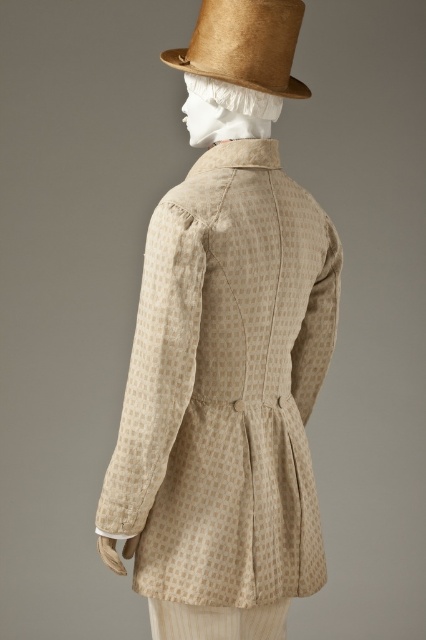
You are a tailor measuring garments for a costume. You need to determine which item is taller between the beige textured jacket at center and the brown straw hat at upper center. Which one is taller?

The beige textured jacket at center is much taller than the brown straw hat at upper center according to the description.

You are a tailor standing 1.5 meters away from the beige textured jacket at center. You need to measure the jacket to make adjustments. Can you comfortably reach the jacket to take measurements without moving closer?

The beige textured jacket at center is 1.06 meters away from the viewer. Since you are standing 1.5 meters away, you are 0.44 meters farther than the jacket. To comfortably reach the jacket for measurements, you would need to move closer to it.